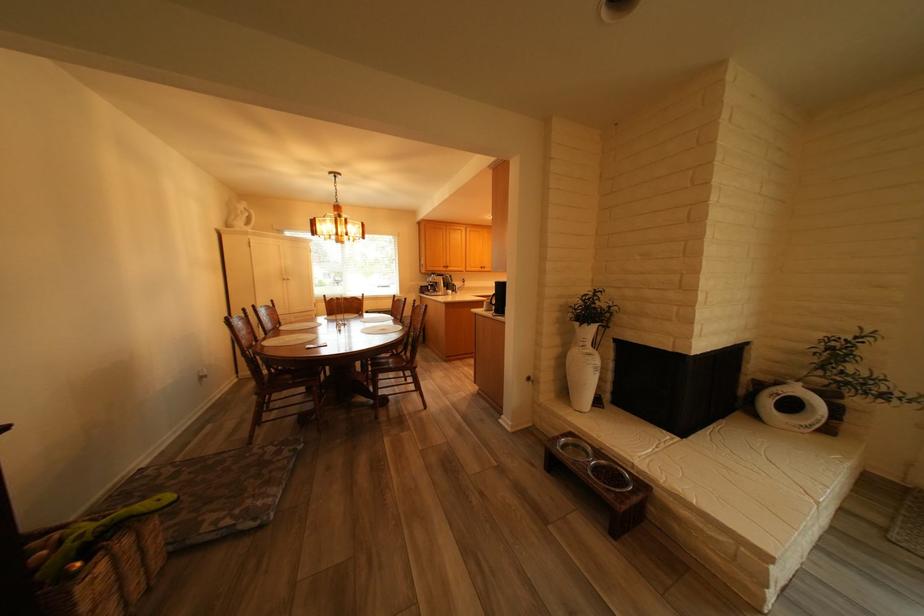
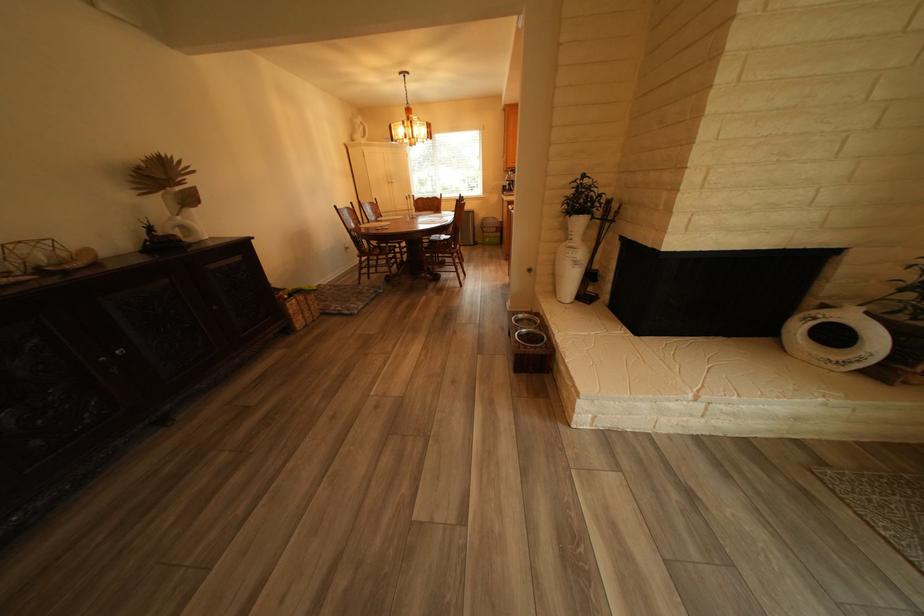
In the second image, find the point that corresponds to pixel 603 355 in the first image.

(585, 249)